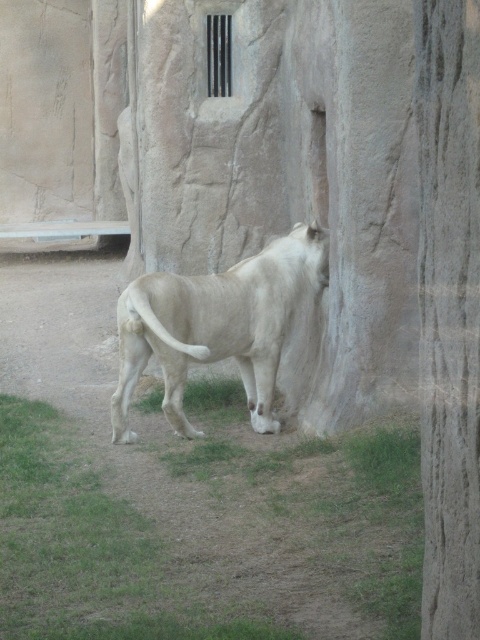
You are a zookeeper standing at the entrance of the enclosure. You need to place a new feeding bowl for the white lion. The bowl requires a flat surface with no grass. Where should you place it to avoid the green grass at lower center?

Place the feeding bowl on the rock wall since the green grass at lower center is located at point (205,529), which is not on the rock wall surface.

You are a zookeeper standing at the entrance of the enclosure. You need to place a new feeding tray on the ground near the green grass at lower center without disturbing the white fur lion at center. Based on the scene, can you safely place the tray there?

The green grass at lower center is closer to the viewer than the white fur lion at center, so placing the feeding tray there would be safe as it is nearer to you and away from the lion.

You are a zookeeper trying to locate two specific points in the lion enclosure. The first point is at coordinate point[154,602] and the second is at coordinate point[302,228]. Which point is nearer to your current position?

Point[154,602] is closer to the camera than point[302,228], so the first point is nearer to your current position.